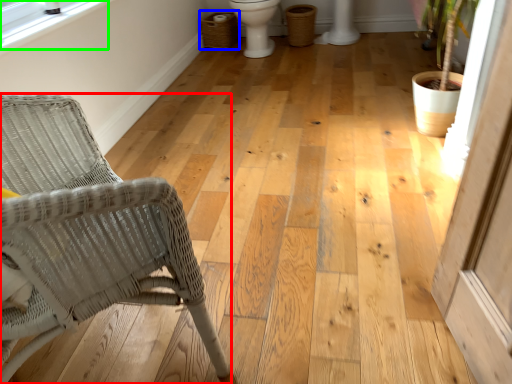
Question: Considering the real-world distances, which object is farthest from chair (highlighted by a red box)? laundry basket (highlighted by a blue box) or window screen (highlighted by a green box)?

Choices:
 (A) laundry basket
 (B) window screen

Answer: (A)